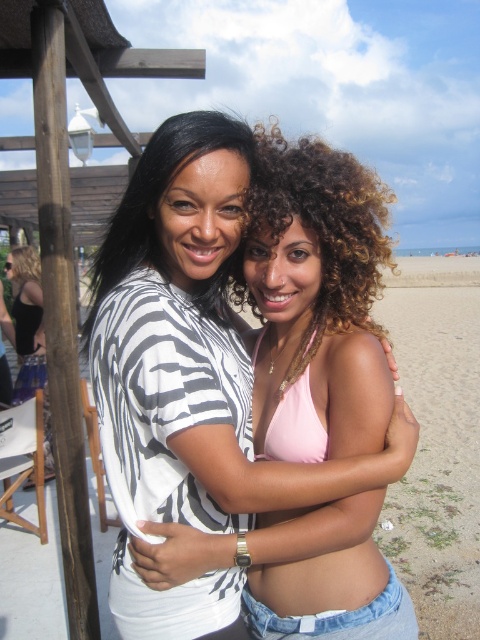
Does white zebra-patterned shirt at center have a larger size compared to zebra-striped shirt at center?

Actually, white zebra-patterned shirt at center might be smaller than zebra-striped shirt at center.

Is point (314, 477) positioned behind point (210, 118)?

No.

Locate an element on the screen. The height and width of the screenshot is (640, 480). white zebra-patterned shirt at center is located at coordinates (191, 376).

Is zebra-striped shirt at center to the left of black matte tank top at left from the viewer's perspective?

In fact, zebra-striped shirt at center is to the right of black matte tank top at left.

Does zebra-striped shirt at center have a lesser width compared to black matte tank top at left?

Indeed, zebra-striped shirt at center has a lesser width compared to black matte tank top at left.

You are a GUI agent. You are given a task and a screenshot of the screen. Output one action in this format:
    pyautogui.click(x=<x>, y=<y>)
    Task: Click on the zebra-striped shirt at center
    The image size is (480, 640).
    Given the screenshot: What is the action you would take?
    pyautogui.click(x=157, y=195)

From the picture: Is white zebra-patterned shirt at center shorter than black matte tank top at left?

Indeed, white zebra-patterned shirt at center has a lesser height compared to black matte tank top at left.

Does white zebra-patterned shirt at center appear on the left side of black matte tank top at left?

No, white zebra-patterned shirt at center is not to the left of black matte tank top at left.

Does point (228, 324) lie in front of point (15, 256)?

That is True.

Where is `white zebra-patterned shirt at center`? The height and width of the screenshot is (640, 480). white zebra-patterned shirt at center is located at coordinates (191, 376).